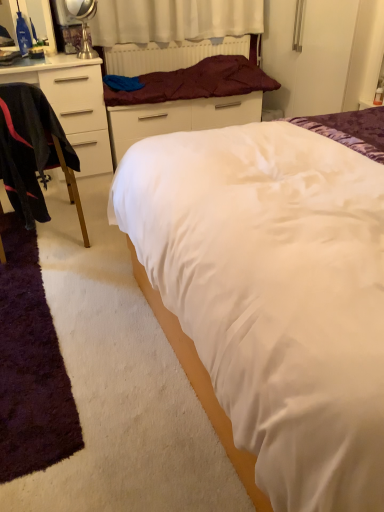
Question: From their relative heights in the image, would you say purple shaggy rug at lower left is taller or shorter than white satin bed at center?

Choices:
 (A) tall
 (B) short

Answer: (B)

Question: Is purple shaggy rug at lower left wider or thinner than white satin bed at center?

Choices:
 (A) thin
 (B) wide

Answer: (A)

Question: Estimate the real-world distances between objects in this image. Which object is closer to the white satin bed at center?

Choices:
 (A) white matte cabinet at left
 (B) burgundy fabric blanket at upper center
 (C) black fabric chair at left
 (D) white glossy bed frame at upper center
 (E) maroon fabric radiator at upper center

Answer: (C)

Question: Which is farther from the maroon fabric radiator at upper center?

Choices:
 (A) burgundy fabric blanket at upper center
 (B) purple shaggy rug at lower left
 (C) black fabric chair at left
 (D) white matte cabinet at left
 (E) white glossy bed frame at upper center

Answer: (B)